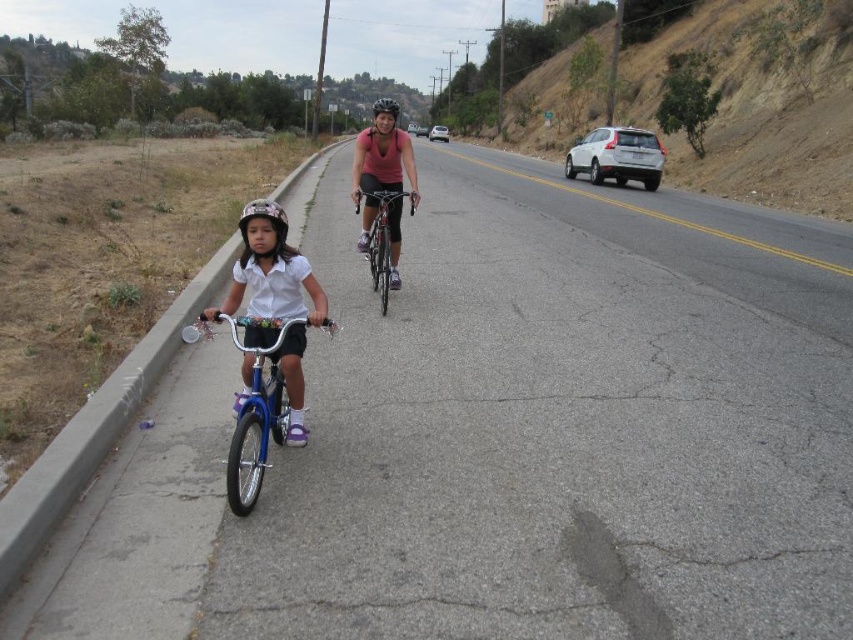
Question: Which point is farther to the camera?

Choices:
 (A) (259, 220)
 (B) (633, 172)
 (C) (392, 104)

Answer: (B)

Question: Can you confirm if matte pink shirt at center is wider than silver metallic sedan at center?

Choices:
 (A) yes
 (B) no

Answer: (B)

Question: Which object appears closest to the camera in this image?

Choices:
 (A) metallic blue bicycle at left
 (B) shiny silver helmet at center

Answer: (A)

Question: Does blue metallic bicycle at left appear on the right side of shiny silver helmet at center?

Choices:
 (A) no
 (B) yes

Answer: (B)

Question: Which object is positioned farthest from the shiny metallic bicycle at center?

Choices:
 (A) metallic blue bicycle at left
 (B) blue metallic bicycle at left
 (C) shiny silver helmet at center
 (D) satin silver suv at right

Answer: (D)

Question: From the image, what is the correct spatial relationship of shiny metallic bicycle at center in relation to matte black helmet at center?

Choices:
 (A) below
 (B) above

Answer: (A)